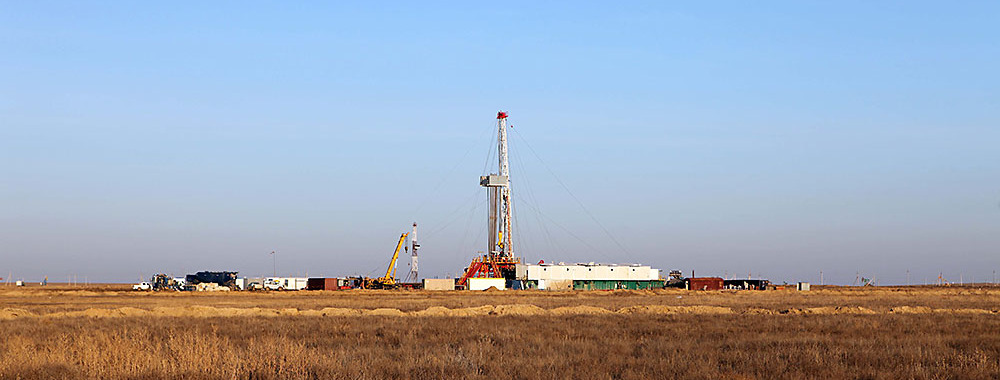
The height and width of the screenshot is (380, 1000). What are the coordinates of `cables` in the screenshot? It's located at (552, 171), (519, 178), (490, 163).